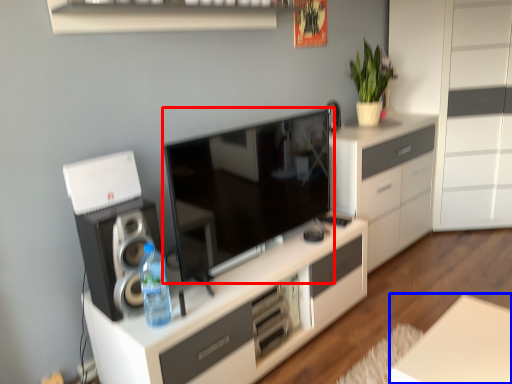
Question: Among these objects, which one is nearest to the camera, television (highlighted by a red box) or table (highlighted by a blue box)?

Choices:
 (A) television
 (B) table

Answer: (B)